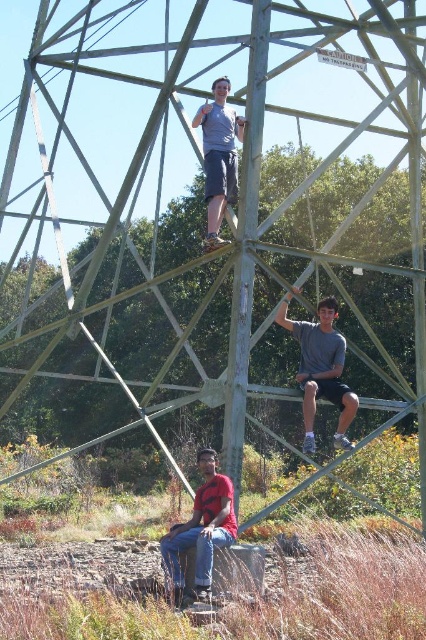
Which is above, matte gray shirt at center or red shirt at lower center?

matte gray shirt at center is higher up.

Is matte gray shirt at center to the left of red shirt at lower center from the viewer's perspective?

In fact, matte gray shirt at center is to the right of red shirt at lower center.

Locate an element on the screen. matte gray shirt at center is located at coordinates 321,369.

Where is `matte gray shirt at center`? The width and height of the screenshot is (426, 640). matte gray shirt at center is located at coordinates (321, 369).

Measure the distance between matte gray shirt at center and camera.

matte gray shirt at center and camera are 111.51 feet apart from each other.

Is matte gray shirt at center to the right of matte gray shirt at upper center from the viewer's perspective?

Correct, you'll find matte gray shirt at center to the right of matte gray shirt at upper center.

Who is more distant from viewer, (305, 348) or (226, 188)?

Positioned behind is point (305, 348).

I want to click on matte gray shirt at center, so click(321, 369).

Can you confirm if red shirt at lower center is smaller than matte gray shirt at upper center?

Yes.

Is red shirt at lower center shorter than matte gray shirt at upper center?

Yes.

Which is behind, point (201, 486) or point (204, 198)?

Positioned behind is point (204, 198).

Identify the location of red shirt at lower center. (201, 529).